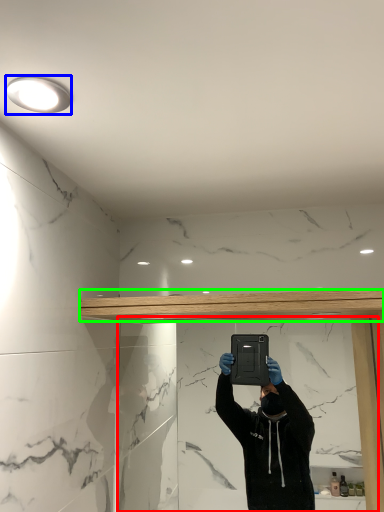
Question: Which object is the farthest from mirror (highlighted by a red box)? Choose among these: light fixture (highlighted by a blue box) or beam (highlighted by a green box).

Choices:
 (A) light fixture
 (B) beam

Answer: (A)